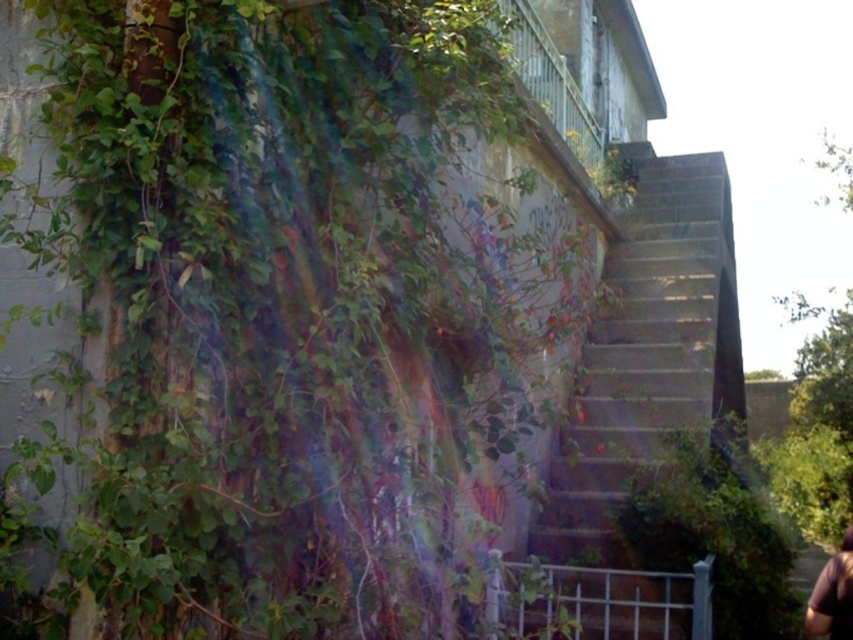
Is green leafy plant at upper left behind concrete stairs at center?

No, green leafy plant at upper left is closer to the viewer.

Who is shorter, green leafy plant at upper left or concrete stairs at center?

With less height is green leafy plant at upper left.

Does point (468, 307) come farther from viewer compared to point (711, 401)?

No.

I want to click on green leafy plant at upper left, so [294, 291].

Can you confirm if green leafy plant at lower right is shorter than brown fabric at lower right?

Incorrect, green leafy plant at lower right's height does not fall short of brown fabric at lower right's.

What do you see at coordinates (715, 529) in the screenshot? I see `green leafy plant at lower right` at bounding box center [715, 529].

At what (x,y) coordinates should I click in order to perform the action: click on green leafy plant at lower right. Please return your answer as a coordinate pair (x, y). Looking at the image, I should click on (715, 529).

Does green leafy plant at upper left have a lesser width compared to brown fabric at lower right?

No.

Identify the location of green leafy plant at upper left. The width and height of the screenshot is (853, 640). (294, 291).